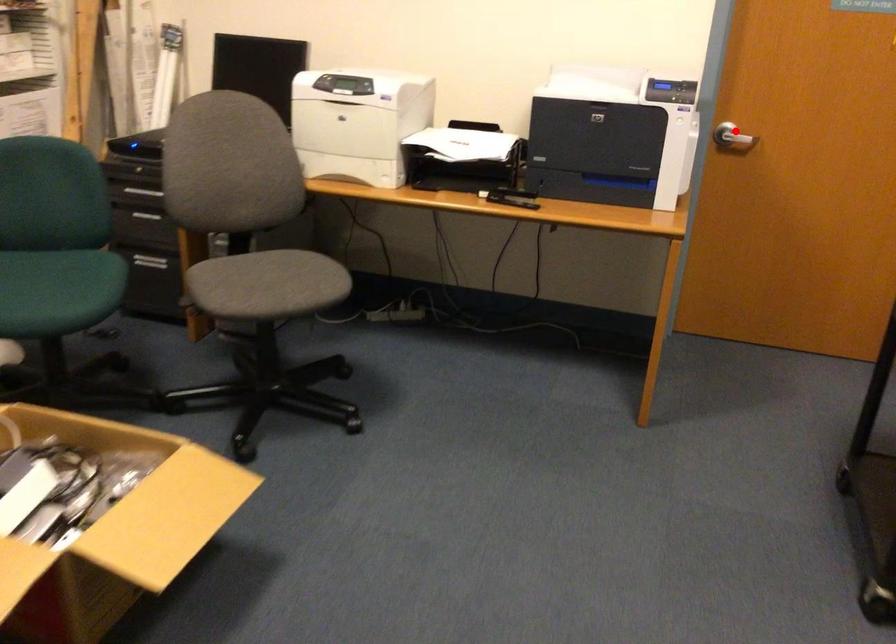
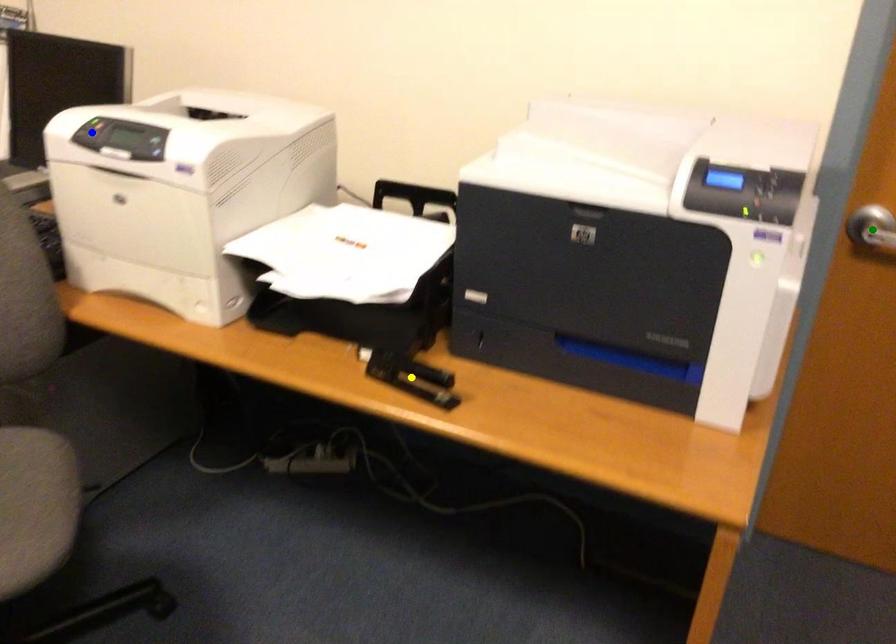
Question: I am providing you with two images of the same scene from different viewpoints. A red point is marked on the first image. You are given multiple points on the second image. Which point in image 2 is actually the same real-world point as the red point in image 1?

Choices:
 (A) blue point
 (B) yellow point
 (C) green point

Answer: (C)